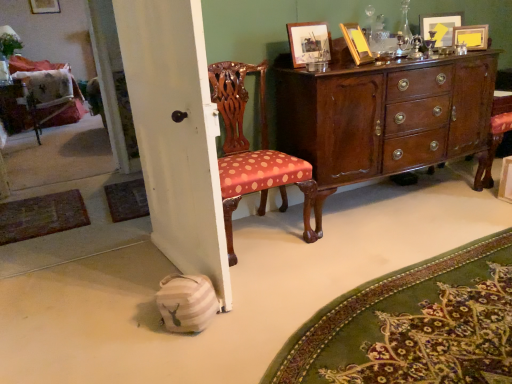
In order to click on free space in front of wooden picture frame at upper right, which is the 3th picture frame from right to left in this screenshot , I will do `click(357, 66)`.